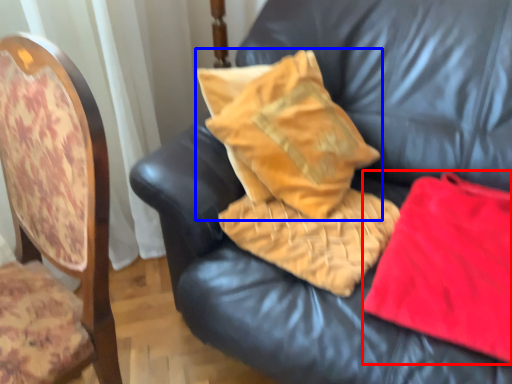
Question: Which point is further to the camera, material (highlighted by a red box) or pillow (highlighted by a blue box)?

Choices:
 (A) material
 (B) pillow

Answer: (B)